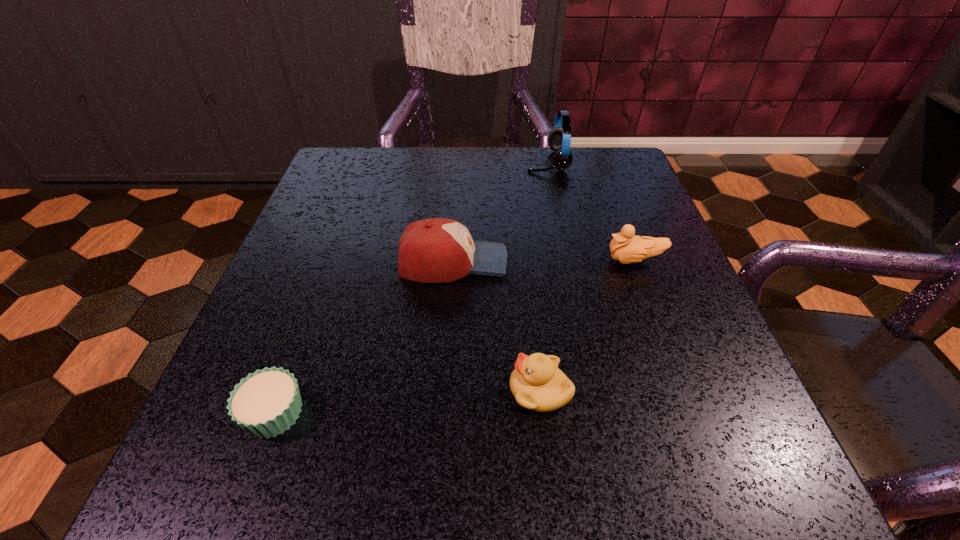
I want to click on object present at the near edge, so click(266, 403).

This screenshot has width=960, height=540. Identify the location of object positioned at the left edge. (266, 403).

Where is `headset present at the right edge`? This screenshot has width=960, height=540. headset present at the right edge is located at coordinates (559, 140).

The width and height of the screenshot is (960, 540). I want to click on duckling at the right edge, so click(x=626, y=248).

Identify the location of object at the near left corner. (266, 403).

This screenshot has height=540, width=960. Identify the location of object situated at the far right corner. (559, 140).

Find the location of `free region at the far edge`. free region at the far edge is located at coordinates (432, 173).

In the image, there is a desktop. Identify the location of vacant space at the near edge. The height and width of the screenshot is (540, 960). (600, 483).

What are the coordinates of `vacant region at the right edge of the desktop` in the screenshot? It's located at point(599,208).

You are a GUI agent. You are given a task and a screenshot of the screen. Output one action in this format:
    pyautogui.click(x=<x>, y=<y>)
    Task: Click on the vacant space at the near left corner of the desktop
    The height and width of the screenshot is (540, 960).
    Given the screenshot: What is the action you would take?
    pyautogui.click(x=295, y=450)